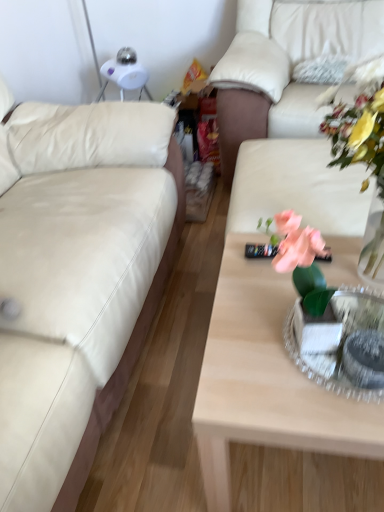
Question: Considering the relative positions of metallic silver tray at center and light wood coffee table at center in the image provided, is metallic silver tray at center to the left or to the right of light wood coffee table at center?

Choices:
 (A) right
 (B) left

Answer: (A)

Question: From the image's perspective, is metallic silver tray at center above or below light wood coffee table at center?

Choices:
 (A) below
 (B) above

Answer: (B)

Question: Estimate the real-world distances between objects in this image. Which object is closer to the beige leather couch at left, the 2th studio couch from the right?

Choices:
 (A) white textured pillow at upper right
 (B) light wood coffee table at center
 (C) white leather couch at upper right, which is the second studio couch in left-to-right order
 (D) translucent glass vase at upper right
 (E) metallic silver tray at center

Answer: (B)

Question: Which is nearer to the translucent glass vase at upper right?

Choices:
 (A) light wood coffee table at center
 (B) metallic silver tray at center
 (C) beige leather couch at left, the 1th studio couch from the left
 (D) white leather couch at upper right, which appears as the first studio couch when viewed from the right
 (E) white textured pillow at upper right

Answer: (B)